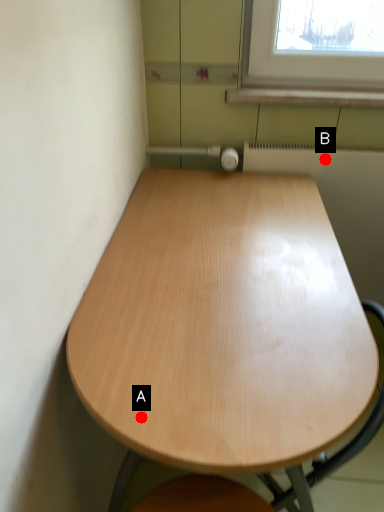
Question: Two points are circled on the image, labeled by A and B beside each circle. Which point is further to the camera?

Choices:
 (A) A is further
 (B) B is further

Answer: (B)